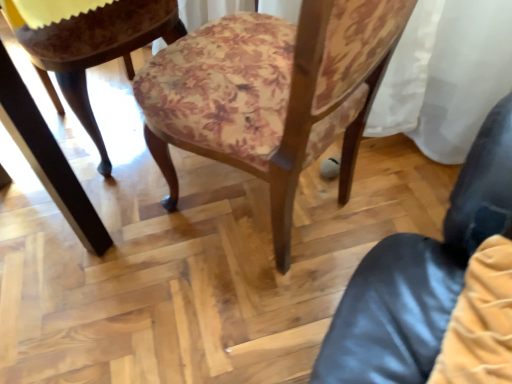
The image size is (512, 384). Identify the location of vacant region in front of floral fabric chair at center. (223, 321).